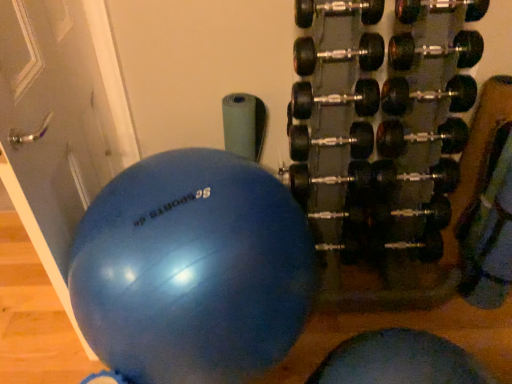
Question: Is blue rubber ball at center spatially inside black rubber dumbbell at right, or outside of it?

Choices:
 (A) inside
 (B) outside

Answer: (B)

Question: From the image's perspective, relative to black rubber dumbbell at right, is blue rubber ball at center above or below?

Choices:
 (A) above
 (B) below

Answer: (B)

Question: Which is nearer to the matte gray door at left?

Choices:
 (A) black rubber dumbbell at right
 (B) blue rubber ball at center

Answer: (B)

Question: Which is nearer to the blue rubber ball at center?

Choices:
 (A) matte gray door at left
 (B) black rubber dumbbell at right

Answer: (A)